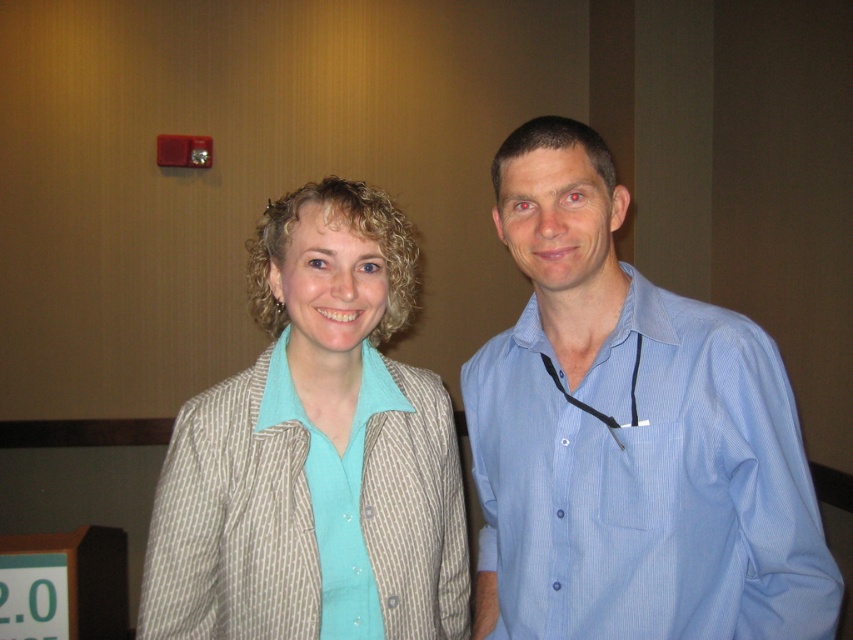
Who is more distant from viewer, (556, 468) or (189, 508)?

Positioned behind is point (556, 468).

Is point (601, 161) less distant than point (196, 422)?

That is False.

Is point (550, 356) positioned behind point (381, 388)?

Yes, point (550, 356) is behind point (381, 388).

You are a GUI agent. You are given a task and a screenshot of the screen. Output one action in this format:
    pyautogui.click(x=<x>, y=<y>)
    Task: Click on the blue striped shirt at right
    
    Given the screenshot: What is the action you would take?
    pyautogui.click(x=630, y=436)